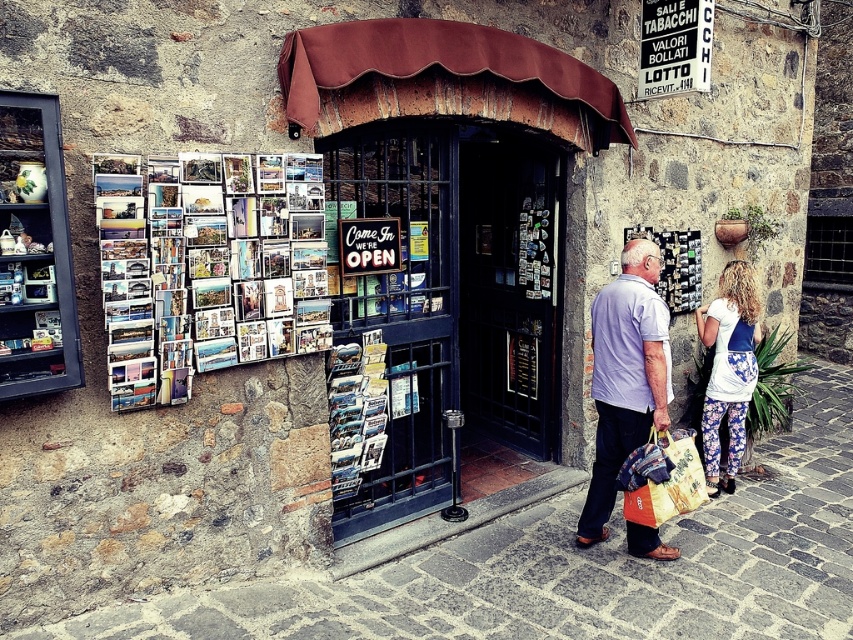
Does point (177, 365) lie behind point (722, 292)?

No, it is not.

Which is below, printed paper collage at upper left or floral leggings at lower right?

floral leggings at lower right is lower down.

Who is more forward, (108, 278) or (752, 364)?

Point (108, 278) is more forward.

Locate an element on the screen. The height and width of the screenshot is (640, 853). printed paper collage at upper left is located at coordinates click(x=216, y=268).

Between printed paper collage at upper left and patterned fabric shopping bag at lower right, which one appears on the left side from the viewer's perspective?

printed paper collage at upper left is more to the left.

Is point (190, 362) behind point (680, 456)?

No, it is in front of (680, 456).

The height and width of the screenshot is (640, 853). I want to click on printed paper collage at upper left, so click(216, 268).

Does point (173, 280) lie behind point (363, 355)?

No, it is not.

Based on the photo, is printed paper collage at upper left closer to camera compared to printed paper magazine at center?

Yes, printed paper collage at upper left is closer to the viewer.

Between point (277, 218) and point (331, 376), which one is positioned behind?

Point (331, 376)

Where is `printed paper collage at upper left`? printed paper collage at upper left is located at coordinates (216, 268).